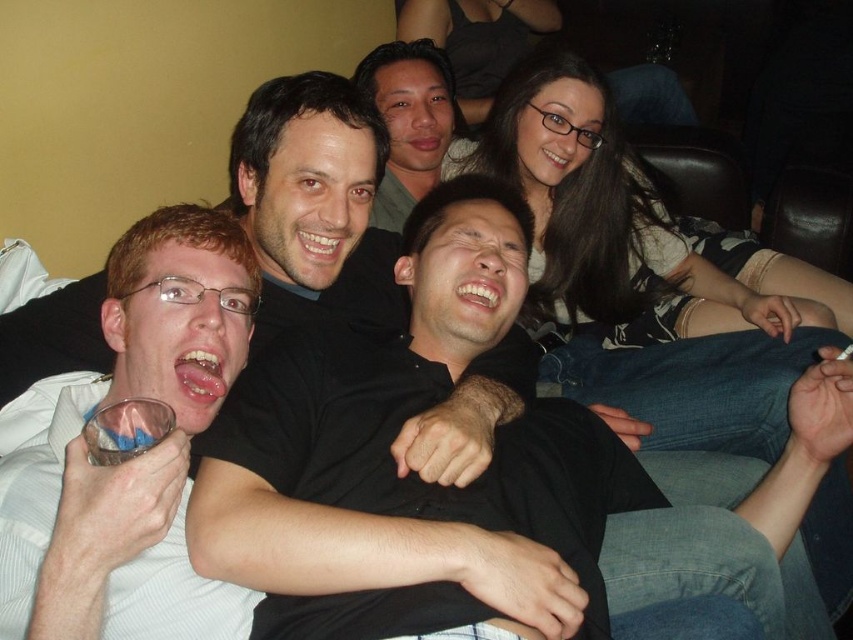
Question: Can you confirm if black matte shirt at center is bigger than matte black shirt at center?

Choices:
 (A) no
 (B) yes

Answer: (B)

Question: Which point is farther from the camera taking this photo?

Choices:
 (A) (3, 564)
 (B) (309, 512)
 (C) (4, 346)
 (D) (387, 164)

Answer: (D)

Question: Which of the following is the farthest from the observer?

Choices:
 (A) matte black shirt at upper center
 (B) black matte shirt at center
 (C) white striped shirt at left

Answer: (A)

Question: Which object is positioned farthest from the matte black shirt at upper center?

Choices:
 (A) matte black shirt at center
 (B) white striped shirt at left
 (C) black matte shirt at center

Answer: (A)

Question: Is the position of black matte shirt at center more distant than that of white striped shirt at left?

Choices:
 (A) yes
 (B) no

Answer: (A)

Question: Is black matte shirt at center thinner than matte black shirt at center?

Choices:
 (A) yes
 (B) no

Answer: (B)